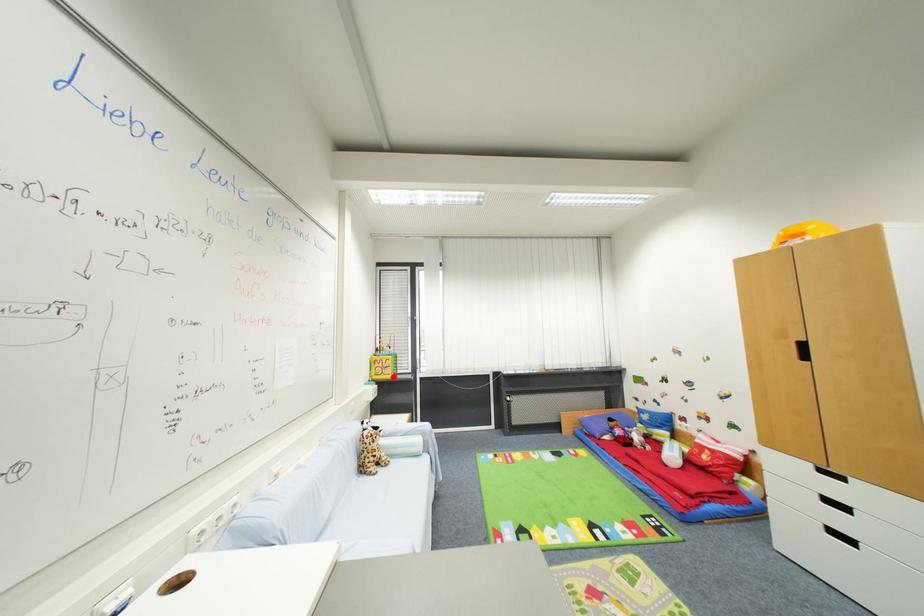
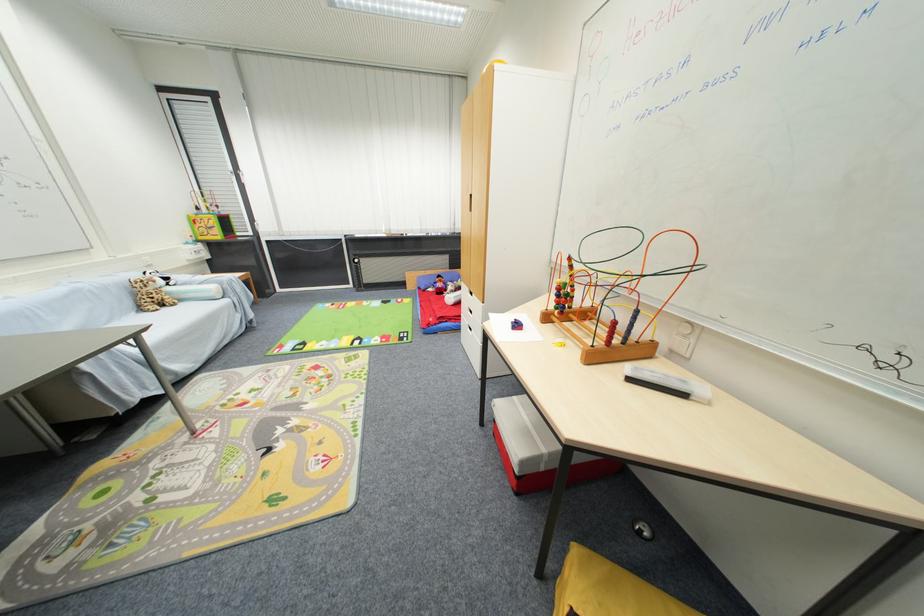
Question: I am providing you with two images of the same scene from different viewpoints. Given a red point in image1, look at the same physical point in image2. Is it:

Choices:
 (A) Closer to the viewpoint
 (B) Farther from the viewpoint

Answer: (A)